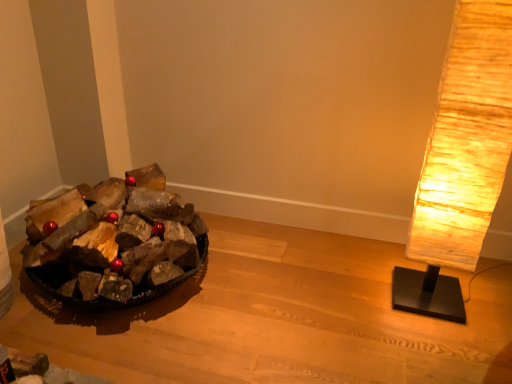
Locate an element on the screen. The width and height of the screenshot is (512, 384). free space to the left of rustic paper lamp at right is located at coordinates (362, 306).